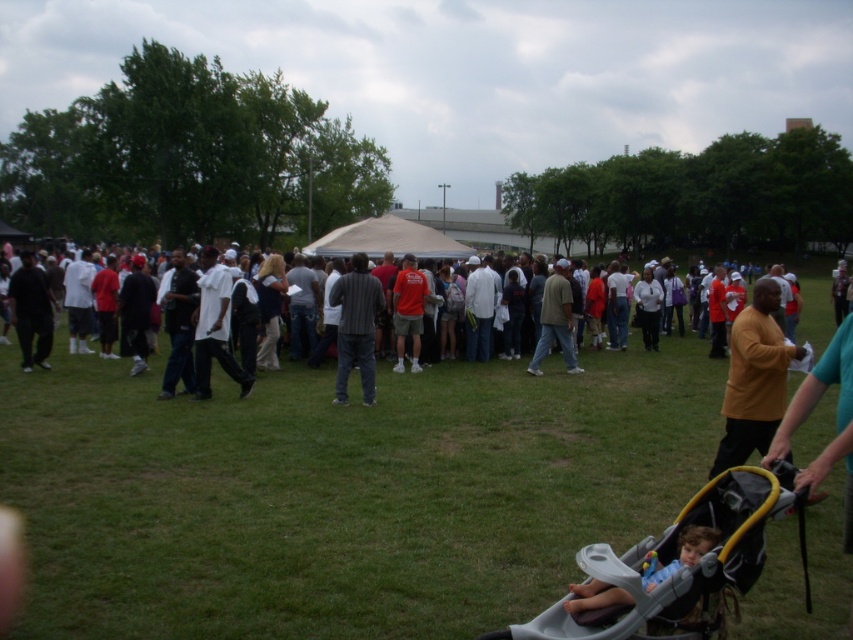
You are a photographer trying to capture a clear photo of both the striped shirt at center and the white matte coat at center. Since you can only focus on one subject at a time, which one should you choose to ensure the other is still somewhat in focus?

The striped shirt at center is closer to the viewer than the white matte coat at center, so focusing on the striped shirt at center will keep the white matte coat at center in better focus due to the depth of field.

You are a photographer trying to capture a candid shot of the white matte shirt at center and the matte black pants at left during the outdoor gathering. Based on their heights, which one would you need to adjust your camera angle for to ensure both are fully visible in the frame?

The white matte shirt at center has a lesser height compared to matte black pants at left, so you would need to lower your camera angle slightly to ensure the taller matte black pants at left is fully captured while still including the shorter white matte shirt at center in the frame.

You are standing in the park and want to move from point A to point B. Point A is at coordinates point [347,289] and point B is at coordinates point [479,276]. Which point is closer to you?

Point [347,289] is closer to the viewer than point [479,276], so you are closer to point A.